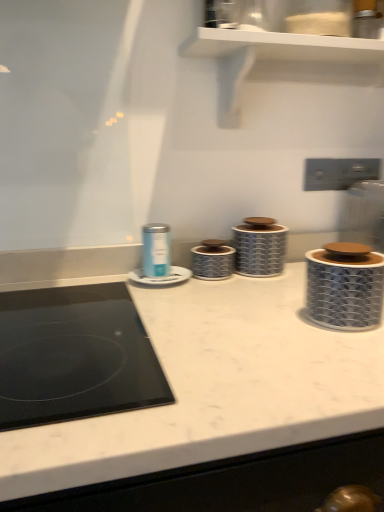
Question: Does matte blue canister at center, acting as the 4th appliance starting from the right, appear on the left side of matte blue canister at center, which is counted as the 1th appliance, starting from the left?

Choices:
 (A) no
 (B) yes

Answer: (A)

Question: Is matte blue canister at center, which is the second appliance in left-to-right order, placed right next to matte blue canister at center, arranged as the fifth appliance when viewed from the right?

Choices:
 (A) yes
 (B) no

Answer: (A)

Question: From a real-world perspective, is matte blue canister at center, acting as the 4th appliance starting from the right, positioned over matte blue canister at center, arranged as the fifth appliance when viewed from the right, based on gravity?

Choices:
 (A) no
 (B) yes

Answer: (A)

Question: Can you confirm if matte blue canister at center, which is the second appliance in left-to-right order, is thinner than matte blue canister at center, which is counted as the 1th appliance, starting from the left?

Choices:
 (A) yes
 (B) no

Answer: (B)

Question: Can you confirm if matte blue canister at center, acting as the 4th appliance starting from the right, is wider than matte blue canister at center, arranged as the fifth appliance when viewed from the right?

Choices:
 (A) yes
 (B) no

Answer: (A)

Question: From their relative heights in the image, would you say silver textured canister at center, which is counted as the third appliance, starting from the right, is taller or shorter than blue textured container at right, acting as the 1th appliance starting from the right?

Choices:
 (A) short
 (B) tall

Answer: (A)

Question: From the image's perspective, is silver textured canister at center, which is counted as the third appliance, starting from the right, above or below blue textured container at right, acting as the 1th appliance starting from the right?

Choices:
 (A) below
 (B) above

Answer: (B)

Question: Looking at the image, does silver textured canister at center, which is counted as the third appliance, starting from the right, seem bigger or smaller compared to blue textured container at right, the fifth appliance from the left?

Choices:
 (A) big
 (B) small

Answer: (B)

Question: In the image, is silver textured canister at center, the 3th appliance viewed from the left, on the left side or the right side of blue textured container at right, the fifth appliance from the left?

Choices:
 (A) right
 (B) left

Answer: (B)

Question: In terms of height, does blue textured container at right, the fifth appliance from the left, look taller or shorter compared to matte blue canister at center, arranged as the fifth appliance when viewed from the right?

Choices:
 (A) tall
 (B) short

Answer: (A)

Question: Does point (311, 307) appear closer or farther from the camera than point (152, 228)?

Choices:
 (A) farther
 (B) closer

Answer: (B)

Question: Looking at their shapes, would you say blue textured container at right, acting as the 1th appliance starting from the right, is wider or thinner than matte blue canister at center, which is counted as the 1th appliance, starting from the left?

Choices:
 (A) wide
 (B) thin

Answer: (A)

Question: Considering the positions of blue textured container at right, acting as the 1th appliance starting from the right, and matte blue canister at center, arranged as the fifth appliance when viewed from the right, in the image, is blue textured container at right, acting as the 1th appliance starting from the right, bigger or smaller than matte blue canister at center, arranged as the fifth appliance when viewed from the right,?

Choices:
 (A) small
 (B) big

Answer: (B)

Question: In terms of height, does matte blue canister at center, which is the second appliance in left-to-right order, look taller or shorter compared to blue and white ceramic canister at center, the second appliance when ordered from right to left?

Choices:
 (A) tall
 (B) short

Answer: (B)

Question: Is matte blue canister at center, which is the second appliance in left-to-right order, to the left or to the right of blue and white ceramic canister at center, the second appliance when ordered from right to left, in the image?

Choices:
 (A) right
 (B) left

Answer: (B)